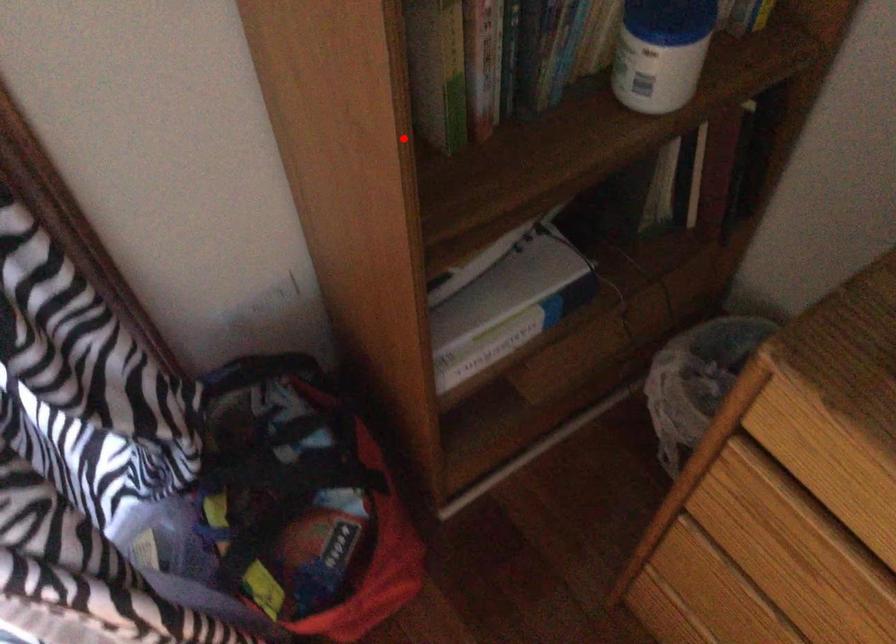
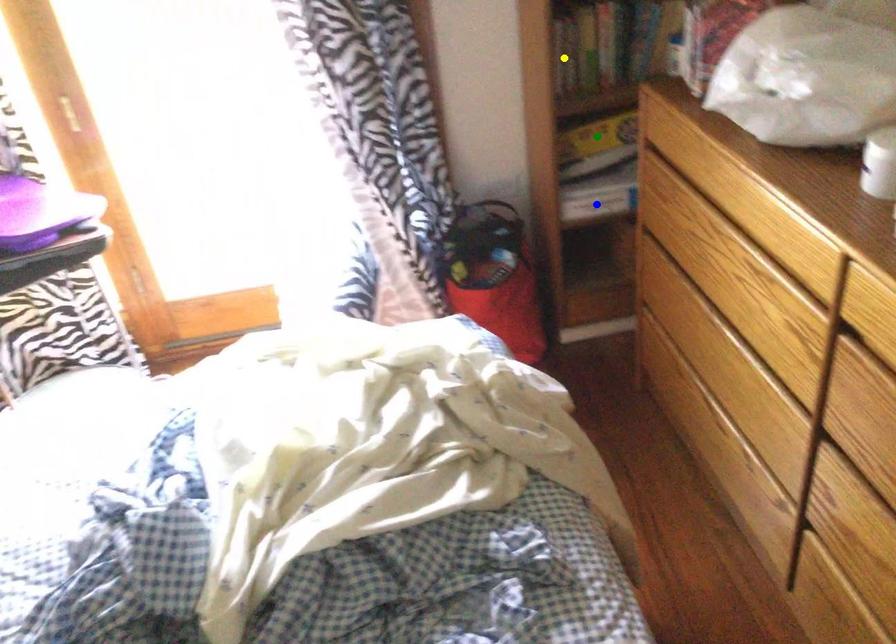
Question: I am providing you with two images of the same scene from different viewpoints. A red point is marked on the first image. You are given multiple points on the second image. Which point in image 2 is actually the same real-world point as the red point in image 1?

Choices:
 (A) blue point
 (B) yellow point
 (C) green point

Answer: (B)